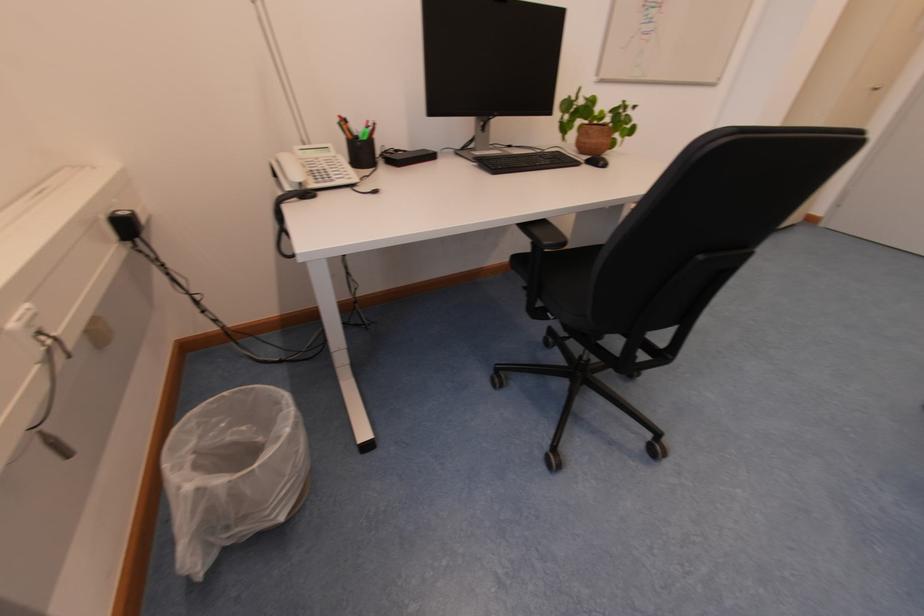
The image size is (924, 616). Describe the element at coordinates (296, 193) in the screenshot. I see `the telephone handset` at that location.